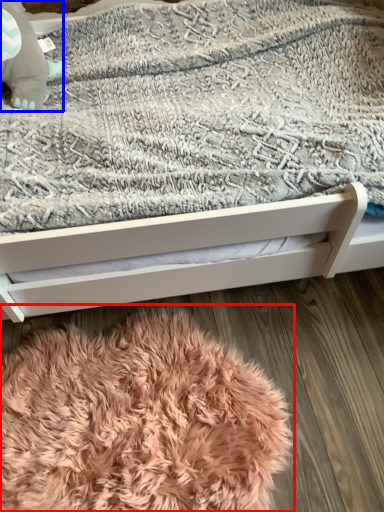
Question: Which object appears closest to the camera in this image, blanket (highlighted by a red box) or baby elephant (highlighted by a blue box)?

Choices:
 (A) blanket
 (B) baby elephant

Answer: (A)